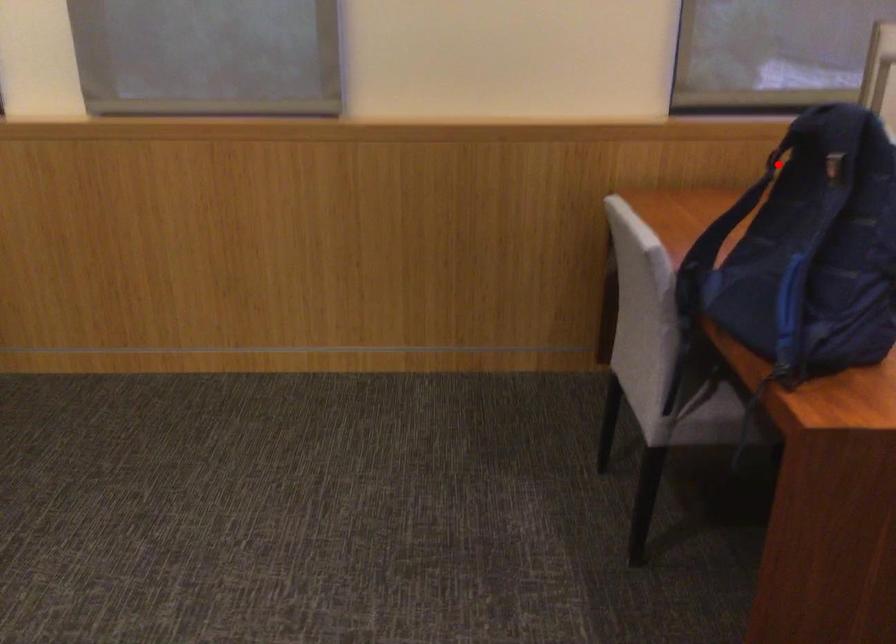
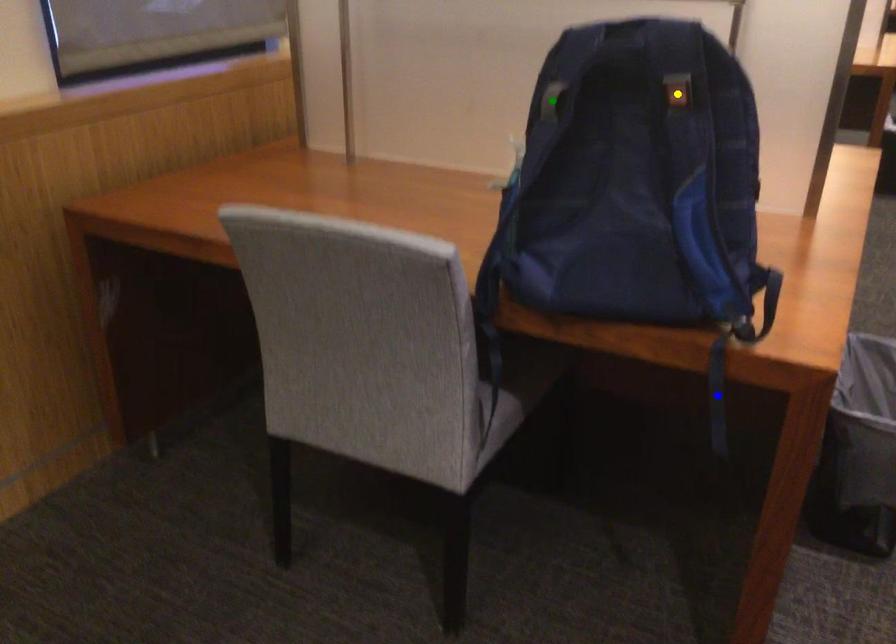
Question: I am providing you with two images of the same scene from different viewpoints. A red point is marked on the first image. You are given multiple points on the second image. Which point in image 2 is actually the same real-world point as the red point in image 1?

Choices:
 (A) green point
 (B) blue point
 (C) yellow point

Answer: (A)